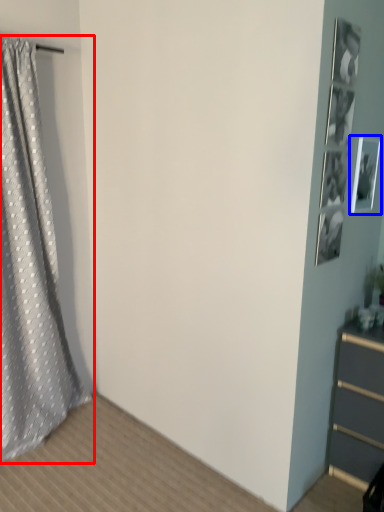
Question: Which object appears closest to the camera in this image, curtain (highlighted by a red box) or picture frame (highlighted by a blue box)?

Choices:
 (A) curtain
 (B) picture frame

Answer: (A)